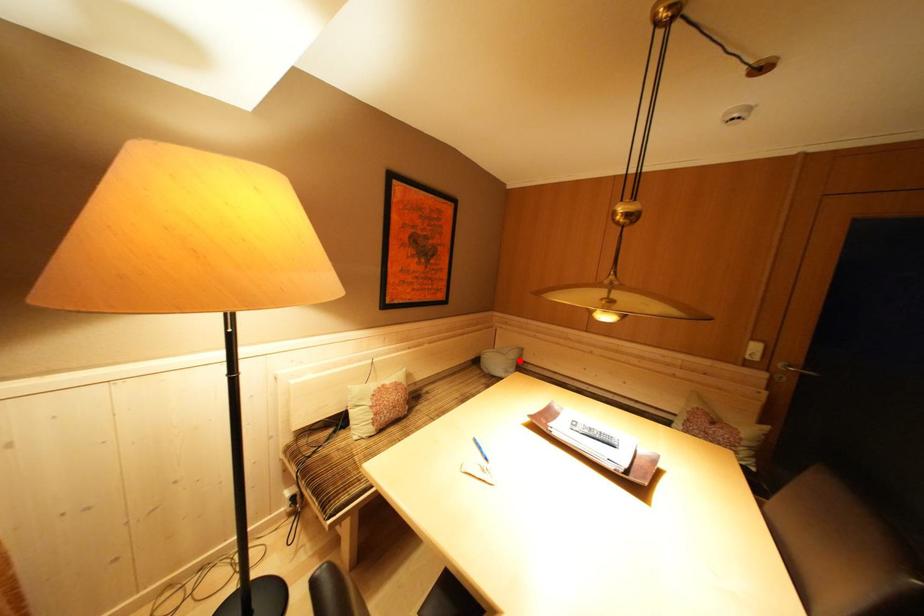
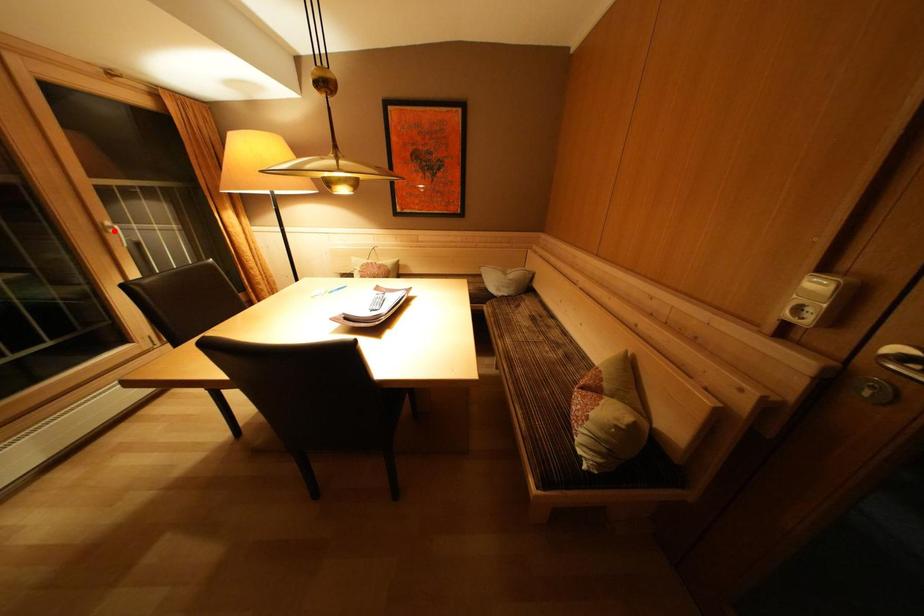
I am providing you with two images of the same scene from different viewpoints. A red point is marked on the first image and another point is marked on the second image. Are the points marked in image1 and image2 representing the same 3D position?

No